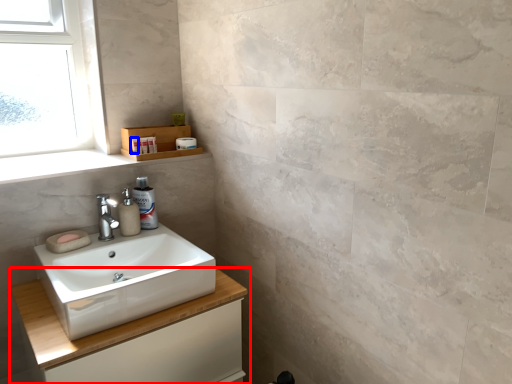
Question: Which object is closer to the camera taking this photo, bathroom cabinet (highlighted by a red box) or toiletry (highlighted by a blue box)?

Choices:
 (A) bathroom cabinet
 (B) toiletry

Answer: (A)